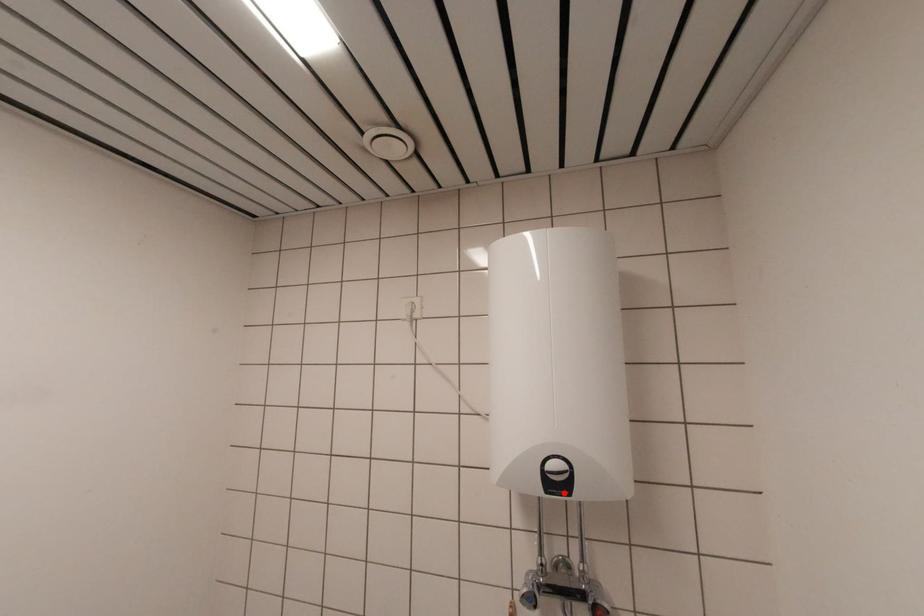
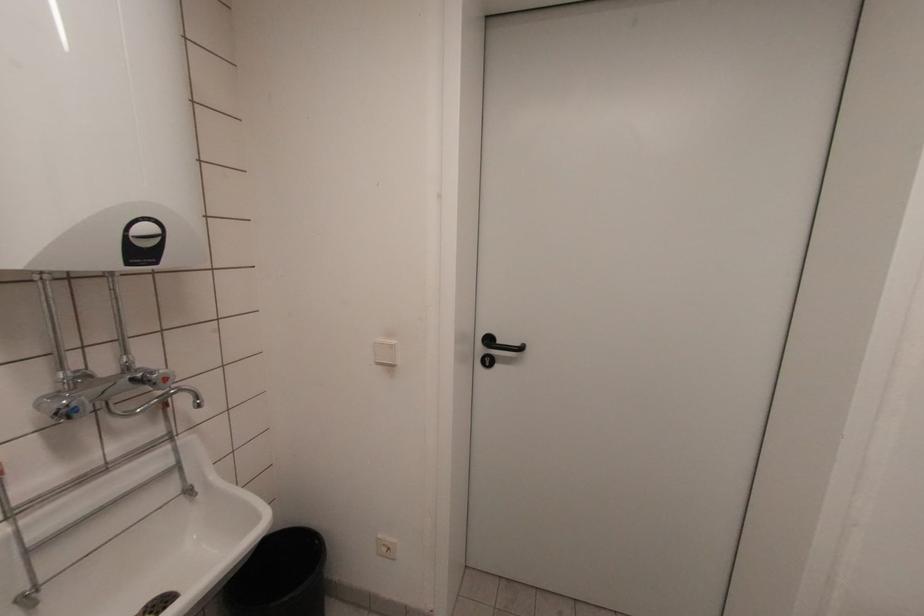
In the second image, find the point that corresponds to the highlighted location in the first image.

(151, 261)